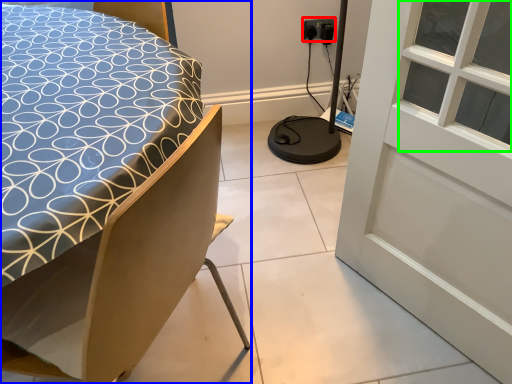
Question: Which object is the closest to the electric outlet (highlighted by a red box)? Choose among these: bed (highlighted by a blue box) or window (highlighted by a green box).

Choices:
 (A) bed
 (B) window

Answer: (B)